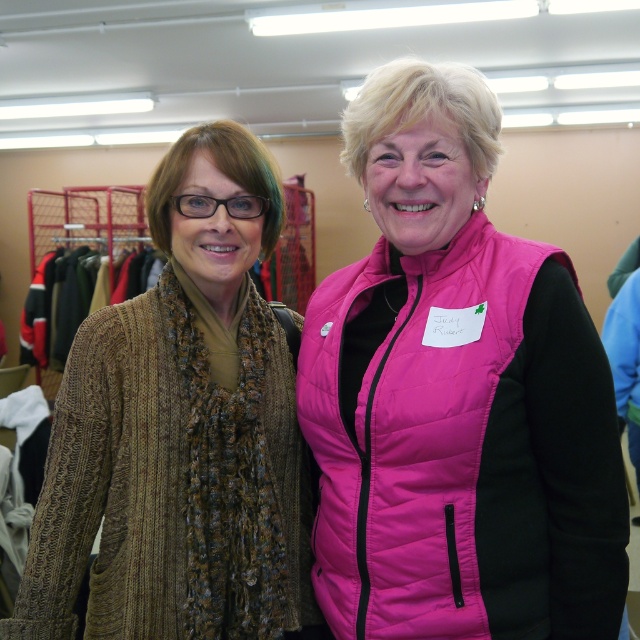
You are organizing a clothing donation drive and need to determine if the pink quilted vest at center and the knitted brown scarf at left can fit side by side on a display rack that is 1 meter wide. Can both items fit together?

The pink quilted vest at center is wider than the knitted brown scarf at left. However, since the combined width of both items is not provided, it is impossible to determine if they can fit on the 1 meter wide display rack without additional information.

You are a delivery robot with a package that needs to be delivered to the woman on the right. You are currently at the point marked at coordinates point (518, 614). The woman on the right is standing 1.03 meters away from you. Can you reach her directly without moving around any obstacles?

The distance between you and the woman on the right is 1.03 meters. Since there are no obstacles mentioned in the scene description, you can reach her directly.